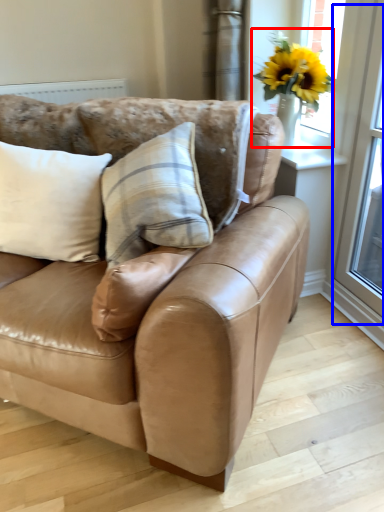
Question: Which object is closer to the camera taking this photo, floral arrangement (highlighted by a red box) or screen door (highlighted by a blue box)?

Choices:
 (A) floral arrangement
 (B) screen door

Answer: (B)